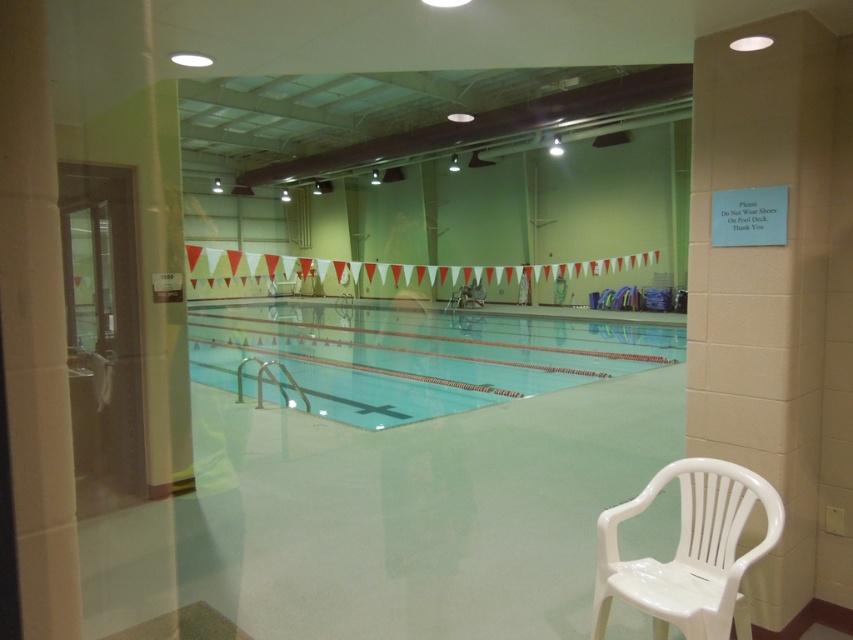
You are a lifeguard standing at the edge of the clear glass pool at center. You notice a white plastic chair at lower right. Which object is taller from your viewpoint?

The clear glass pool at center is taller than the white plastic chair at lower right according to the description.

You are a lifeguard standing at the edge of the clear glass pool at center. You notice a swimmer in distress 4.47 meters away from you. According to the American Red Cross guidelines, the maximum recommended distance for a lifeguard to respond to a swimmer in distress is 25 meters. Can you safely respond to this swimmer within the recommended distance?

The swimmer in distress is 4.47 meters away from the clear glass pool at center, which is well within the 25 meters maximum recommended distance according to American Red Cross guidelines. Therefore, you can safely respond to the swimmer within the recommended distance.